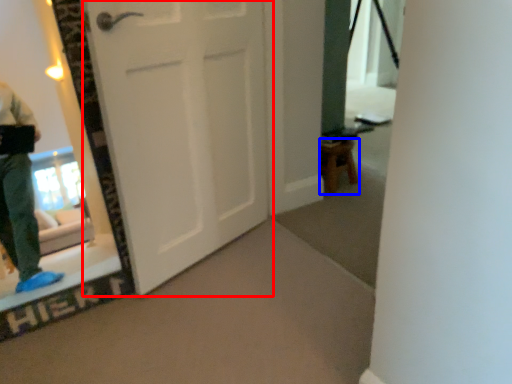
Question: Which object appears closest to the camera in this image, door (highlighted by a red box) or furniture (highlighted by a blue box)?

Choices:
 (A) door
 (B) furniture

Answer: (A)